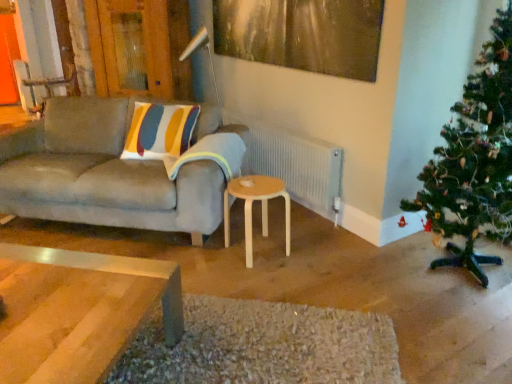
Locate an element on the screen. Image resolution: width=512 pixels, height=384 pixels. striped fabric pillow at center is located at coordinates (211, 154).

Describe the element at coordinates (293, 162) in the screenshot. Image resolution: width=512 pixels, height=384 pixels. I see `white textured radiator at center` at that location.

Identify the location of natural wood stool at center. (251, 207).

The width and height of the screenshot is (512, 384). I want to click on metallic gold painting at upper center, so click(x=302, y=34).

You are a GUI agent. You are given a task and a screenshot of the screen. Output one action in this format:
    pyautogui.click(x=<x>, y=<y>)
    Task: Click on the green textured christmas tree at right
    The height and width of the screenshot is (384, 512).
    Given the screenshot: What is the action you would take?
    pyautogui.click(x=474, y=160)

What do you see at coordinates (207, 52) in the screenshot? I see `metallic silver lamp at upper center` at bounding box center [207, 52].

Identify the location of striped fabric pillow at center. (211, 154).

Is green textured christmas tree at right turned away from matte gray couch at left?

No, green textured christmas tree at right is not facing the opposite direction of matte gray couch at left.

Is the surface of green textured christmas tree at right in direct contact with matte gray couch at left?

green textured christmas tree at right is not next to matte gray couch at left, and they're not touching.

Find the location of a particular element. christmas tree positioned vertically above the matte gray couch at left (from a real-world perspective) is located at coordinates (474, 160).

Between white textured radiator at center and natural wood stool at center, which one has smaller size?

natural wood stool at center is smaller.

Is natural wood stool at center at the back of white textured radiator at center?

That's not correct — white textured radiator at center is not looking away from natural wood stool at center.

Would you say white textured radiator at center is outside natural wood stool at center?

That's correct, white textured radiator at center is outside of natural wood stool at center.

Is natural wood stool at center located outside matte gray couch at left?

Yes, natural wood stool at center is located beyond the bounds of matte gray couch at left.

How different are the orientations of natural wood stool at center and matte gray couch at left in degrees?

natural wood stool at center and matte gray couch at left are facing 48.4 degrees away from each other.

Can you confirm if natural wood stool at center is shorter than matte gray couch at left?

Yes, natural wood stool at center is shorter than matte gray couch at left.

From the image's perspective, is natural wood stool at center located beneath matte gray couch at left?

Yes, from the image's perspective, natural wood stool at center is beneath matte gray couch at left.

From the image's perspective, would you say metallic silver lamp at upper center is shown under matte gray couch at left?

No, from the image's perspective, metallic silver lamp at upper center is not below matte gray couch at left.

From a real-world perspective, is metallic silver lamp at upper center physically above matte gray couch at left?

Yes, from a real-world perspective, metallic silver lamp at upper center is on top of matte gray couch at left.

Looking at this image, which of these two, metallic silver lamp at upper center or matte gray couch at left, is bigger?

matte gray couch at left.

Can you confirm if metallic silver lamp at upper center is shorter than matte gray couch at left?

No.

Is white textured radiator at center situated inside green textured christmas tree at right or outside?

white textured radiator at center is not enclosed by green textured christmas tree at right.

How far apart are white textured radiator at center and green textured christmas tree at right?

98.42 centimeters.

From the picture: From the image's perspective, which object appears higher, white textured radiator at center or green textured christmas tree at right?

white textured radiator at center, from the image's perspective.

Is green textured christmas tree at right at the back of white textured radiator at center?

white textured radiator at center does not have its back to green textured christmas tree at right.

Consider the image. Considering the positions of objects matte gray couch at left and natural wood stool at center in the image provided, who is more to the right, matte gray couch at left or natural wood stool at center?

natural wood stool at center is more to the right.

Is matte gray couch at left surrounding natural wood stool at center?

That's incorrect, natural wood stool at center is not inside matte gray couch at left.

From a real-world perspective, relative to natural wood stool at center, is matte gray couch at left vertically above or below?

matte gray couch at left is above natural wood stool at center.

Is matte gray couch at left taller than natural wood stool at center?

Indeed, matte gray couch at left has a greater height compared to natural wood stool at center.

Would you say matte gray couch at left contains white textured radiator at center?

That's incorrect, white textured radiator at center is not inside matte gray couch at left.

Between matte gray couch at left and white textured radiator at center, which one has more height?

Standing taller between the two is matte gray couch at left.

Which of these two, matte gray couch at left or white textured radiator at center, is bigger?

matte gray couch at left.

Locate an element on the screen. The width and height of the screenshot is (512, 384). radiator above the matte gray couch at left (from the image's perspective) is located at coordinates (293, 162).

Locate an element on the screen. Image resolution: width=512 pixels, height=384 pixels. christmas tree that is below the matte gray couch at left (from the image's perspective) is located at coordinates (474, 160).

Identify the location of radiator above the natural wood stool at center (from a real-world perspective). This screenshot has height=384, width=512. (293, 162).

When comparing their distances from white textured radiator at center, does green textured christmas tree at right or natural wood stool at center seem closer?

natural wood stool at center lies closer to white textured radiator at center than the other object.

Estimate the real-world distances between objects in this image. Which object is closer to wooden armchair at upper left, metallic silver lamp at upper center or white textured radiator at center?

metallic silver lamp at upper center.

When comparing their distances from green textured christmas tree at right, does natural wood stool at center or white textured radiator at center seem closer?

white textured radiator at center is closer to green textured christmas tree at right.

From the image, which object appears to be farther from natural wood stool at center, matte gray couch at left or striped fabric pillow at center?

The object further to natural wood stool at center is matte gray couch at left.

From the image, which object appears to be farther from matte gray couch at left, green textured christmas tree at right or metallic silver lamp at upper center?

Among the two, green textured christmas tree at right is located further to matte gray couch at left.

From the image, which object appears to be farther from metallic silver lamp at upper center, striped fabric pillow at center or metallic gold painting at upper center?

striped fabric pillow at center lies further to metallic silver lamp at upper center than the other object.

Which object lies nearer to the anchor point metallic silver lamp at upper center, matte gray couch at left or wooden armchair at upper left?

matte gray couch at left is closer to metallic silver lamp at upper center.

Looking at the image, which one is located further to metallic silver lamp at upper center, natural wood stool at center or striped fabric pillow at center?

natural wood stool at center.

I want to click on radiator between striped fabric pillow at center and green textured christmas tree at right from left to right, so coord(293,162).

You are a GUI agent. You are given a task and a screenshot of the screen. Output one action in this format:
    pyautogui.click(x=<x>, y=<y>)
    Task: Click on the studio couch situated between wooden armchair at upper left and white textured radiator at center from left to right
    Image resolution: width=512 pixels, height=384 pixels.
    Given the screenshot: What is the action you would take?
    pyautogui.click(x=102, y=174)

This screenshot has height=384, width=512. I want to click on pillow between metallic silver lamp at upper center and green textured christmas tree at right, so click(x=211, y=154).

Find the location of a particular element. The width and height of the screenshot is (512, 384). radiator between green textured christmas tree at right and metallic silver lamp at upper center along the z-axis is located at coordinates (293, 162).